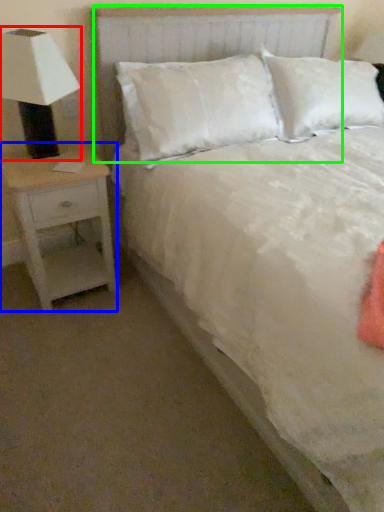
Question: Considering the real-world distances, which object is farthest from lamp (highlighted by a red box)? nightstand (highlighted by a blue box) or headboard (highlighted by a green box)?

Choices:
 (A) nightstand
 (B) headboard

Answer: (B)